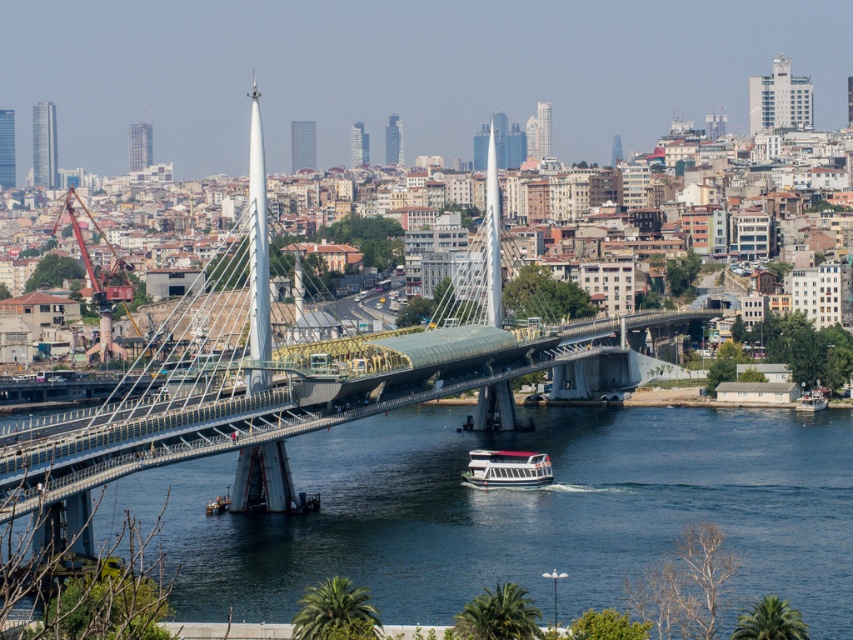
You are a photographer planning to capture the blue water at center and the metallic glass bridge at center in a single shot. Based on their sizes in the image, which object should you focus on first if you want both to be in clear focus?

The metallic glass bridge at center is taller than the blue water at center. To ensure both are in clear focus, you should focus on the metallic glass bridge at center first since it has a greater depth of field requirement due to its height.

You are standing at the base of the cable stayed bridge and looking towards the bridge towers. You see two points marked on the bridge structure. One is at point coordinates point (607, 452) and the other is at point coordinates point (358, 360). Which point is closer to you?

Point (358, 360) is closer to you because it is less further to the camera than point (607, 452).